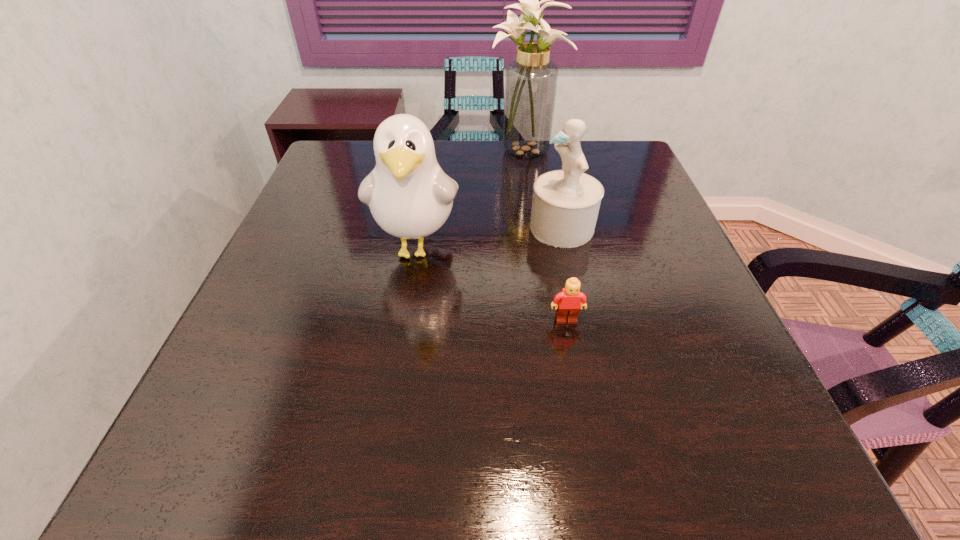
Image resolution: width=960 pixels, height=540 pixels. Find the location of `the farthest object`. the farthest object is located at coordinates (531, 79).

The width and height of the screenshot is (960, 540). What are the coordinates of `flower arrangement` in the screenshot? It's located at (531, 79).

I want to click on gull, so click(x=410, y=197).

Identify the location of the second shortest object. (565, 206).

Locate an element on the screen. The height and width of the screenshot is (540, 960). Lego is located at coordinates (567, 303).

Where is `the shortest object`? the shortest object is located at coordinates (567, 303).

Find the location of a particular element. The width and height of the screenshot is (960, 540). vacant space located on the right of the tallest object is located at coordinates (628, 153).

The image size is (960, 540). I want to click on vacant space located on the beak of the leftmost object, so click(x=379, y=488).

Find the location of a particular element. This screenshot has height=540, width=960. vacant area situated at the beak of the third tallest object is located at coordinates (404, 227).

At what (x,y) coordinates should I click in order to perform the action: click on free region located at the beak of the third tallest object. Please return your answer as a coordinate pair (x, y). Looking at the image, I should click on (471, 227).